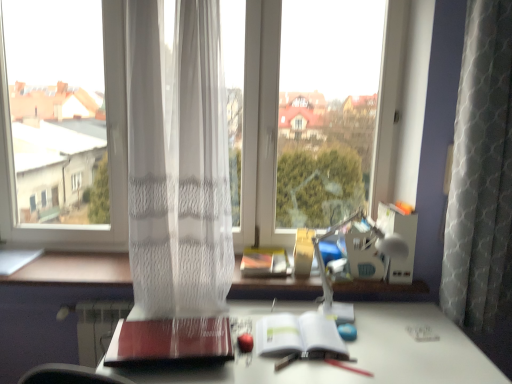
Identify the location of free space that is in between matte red notebook at center, the 1th paperback book viewed from the left, and white paper at center, positioned as the second paperback book in left-to-right order. (263, 354).